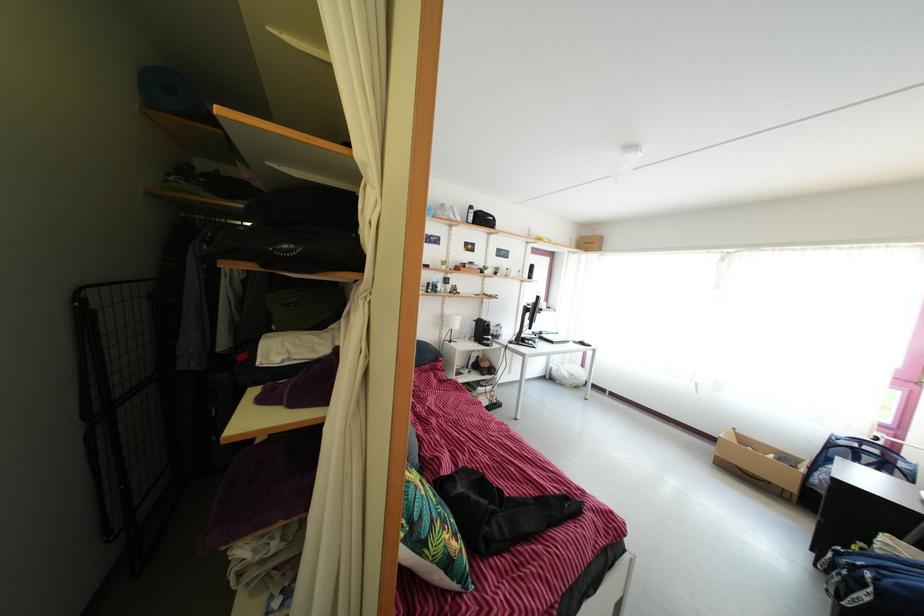
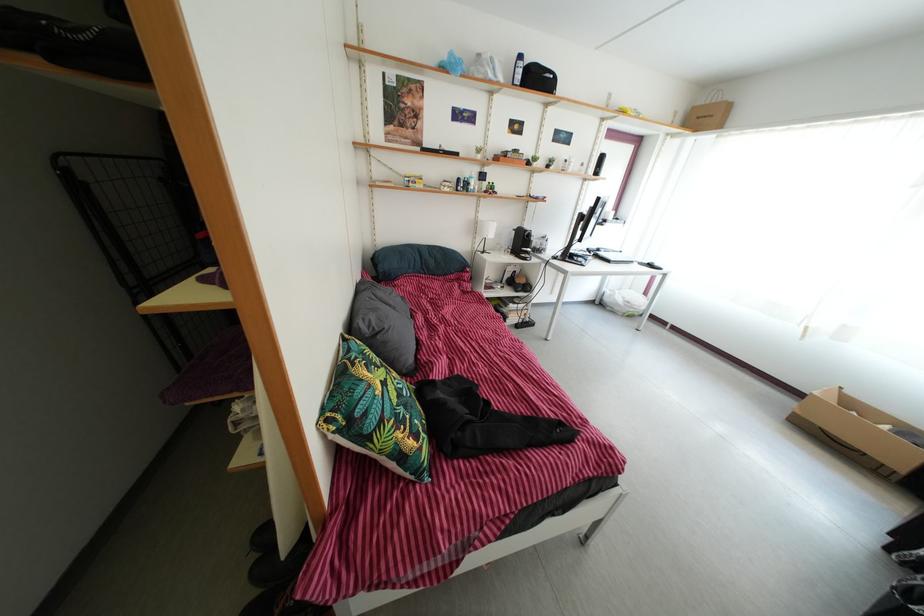
What movement of the cameraman would produce the second image?

The cameraman walked toward right, forward.